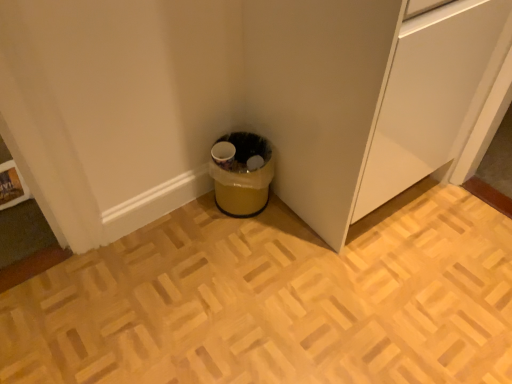
Question: From a real-world perspective, is white matte cabinet at lower center beneath yellow plastic trash can at lower center?

Choices:
 (A) no
 (B) yes

Answer: (A)

Question: Does white matte cabinet at lower center have a greater width compared to yellow plastic trash can at lower center?

Choices:
 (A) yes
 (B) no

Answer: (A)

Question: Does white matte cabinet at lower center lie in front of yellow plastic trash can at lower center?

Choices:
 (A) no
 (B) yes

Answer: (B)

Question: Is white matte cabinet at lower center shorter than yellow plastic trash can at lower center?

Choices:
 (A) yes
 (B) no

Answer: (B)

Question: Is yellow plastic trash can at lower center a part of white matte cabinet at lower center?

Choices:
 (A) no
 (B) yes

Answer: (A)

Question: Considering the relative positions of white matte cabinet at lower center and yellow plastic trash can at lower center in the image provided, is white matte cabinet at lower center to the right of yellow plastic trash can at lower center from the viewer's perspective?

Choices:
 (A) no
 (B) yes

Answer: (B)

Question: Considering the relative sizes of yellow plastic trash can at lower center and white matte cabinet at lower center in the image provided, is yellow plastic trash can at lower center wider than white matte cabinet at lower center?

Choices:
 (A) yes
 (B) no

Answer: (B)

Question: Considering the relative positions of yellow plastic trash can at lower center and white matte cabinet at lower center in the image provided, is yellow plastic trash can at lower center to the right of white matte cabinet at lower center from the viewer's perspective?

Choices:
 (A) no
 (B) yes

Answer: (A)

Question: Could you tell me if yellow plastic trash can at lower center is turned towards white matte cabinet at lower center?

Choices:
 (A) no
 (B) yes

Answer: (A)

Question: From a real-world perspective, does yellow plastic trash can at lower center sit lower than white matte cabinet at lower center?

Choices:
 (A) yes
 (B) no

Answer: (A)

Question: Can you confirm if yellow plastic trash can at lower center is thinner than white matte cabinet at lower center?

Choices:
 (A) yes
 (B) no

Answer: (A)

Question: Is yellow plastic trash can at lower center behind white matte cabinet at lower center?

Choices:
 (A) yes
 (B) no

Answer: (A)

Question: Is yellow plastic trash can at lower center wider or thinner than white matte cabinet at lower center?

Choices:
 (A) wide
 (B) thin

Answer: (B)